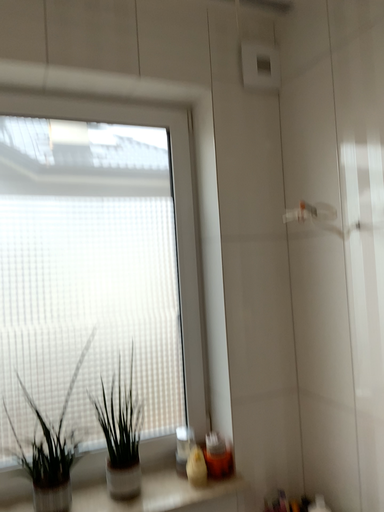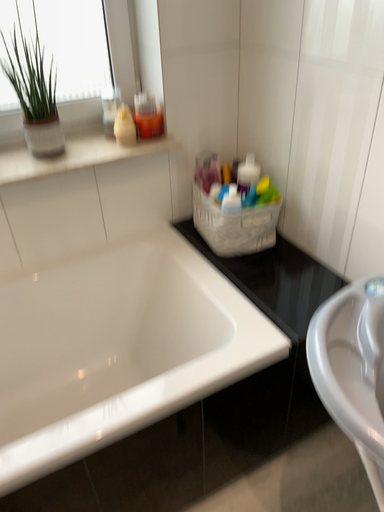
Question: How did the camera likely rotate when shooting the video?

Choices:
 (A) rotated upward
 (B) rotated downward

Answer: (B)